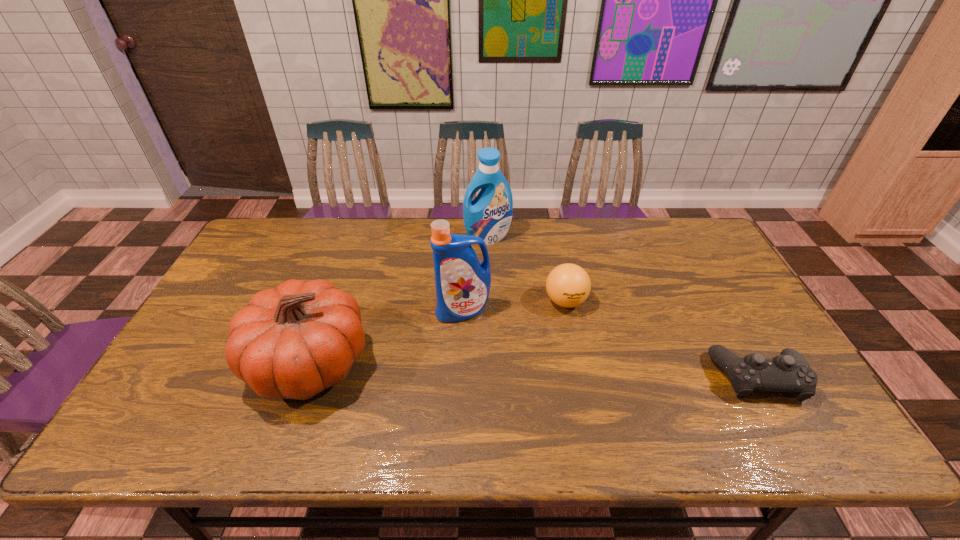
The height and width of the screenshot is (540, 960). In the image, there is a desktop. Find the location of `free space at the near left corner`. free space at the near left corner is located at coordinates (204, 399).

You are a GUI agent. You are given a task and a screenshot of the screen. Output one action in this format:
    pyautogui.click(x=<x>, y=<y>)
    Task: Click on the vacant space at the far right corner
    This screenshot has width=960, height=540.
    Given the screenshot: What is the action you would take?
    pyautogui.click(x=687, y=226)

Where is `empty space that is in between the nearer detergent and the leftmost object`? This screenshot has height=540, width=960. empty space that is in between the nearer detergent and the leftmost object is located at coordinates (386, 337).

Identify the location of free space between the fourth tallest object and the farther detergent. The width and height of the screenshot is (960, 540). (527, 269).

Where is `free spot between the second object from right to left and the nearer detergent`? The image size is (960, 540). free spot between the second object from right to left and the nearer detergent is located at coordinates (515, 306).

Locate an element on the screen. Image resolution: width=960 pixels, height=540 pixels. vacant point located between the farther detergent and the second shortest object is located at coordinates (527, 269).

The width and height of the screenshot is (960, 540). I want to click on unoccupied position between the farthest object and the leftmost object, so click(x=398, y=300).

The width and height of the screenshot is (960, 540). In order to click on free space between the farthest object and the control in this screenshot , I will do `click(623, 307)`.

The height and width of the screenshot is (540, 960). I want to click on vacant area that lies between the second shortest object and the leftmost object, so click(438, 332).

Identify the location of free space between the nearer detergent and the pumpkin. (386, 337).